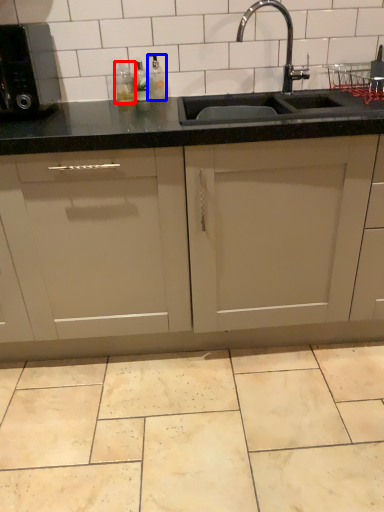
Question: Which of the following is the farthest to the observer, bottle (highlighted by a red box) or bottle (highlighted by a blue box)?

Choices:
 (A) bottle
 (B) bottle

Answer: (A)